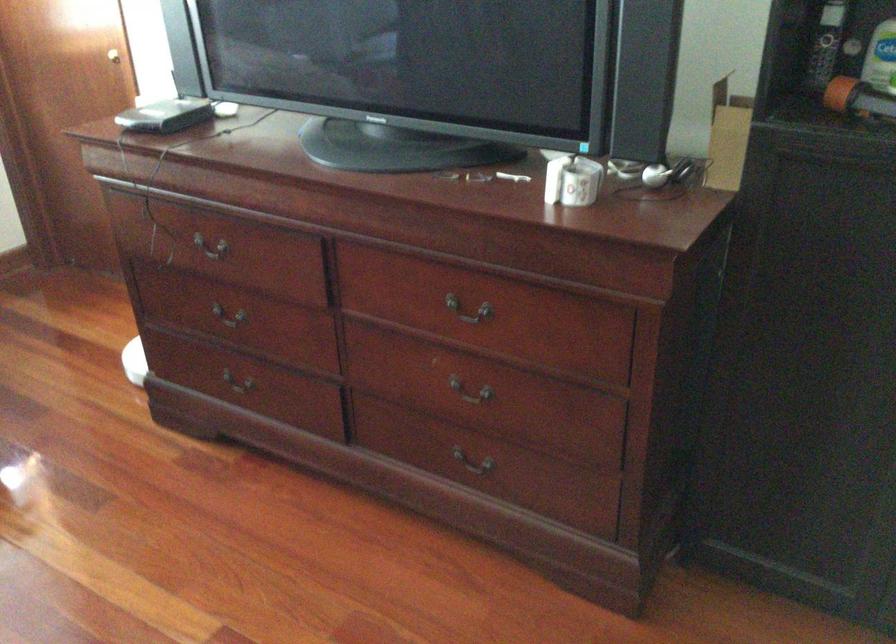
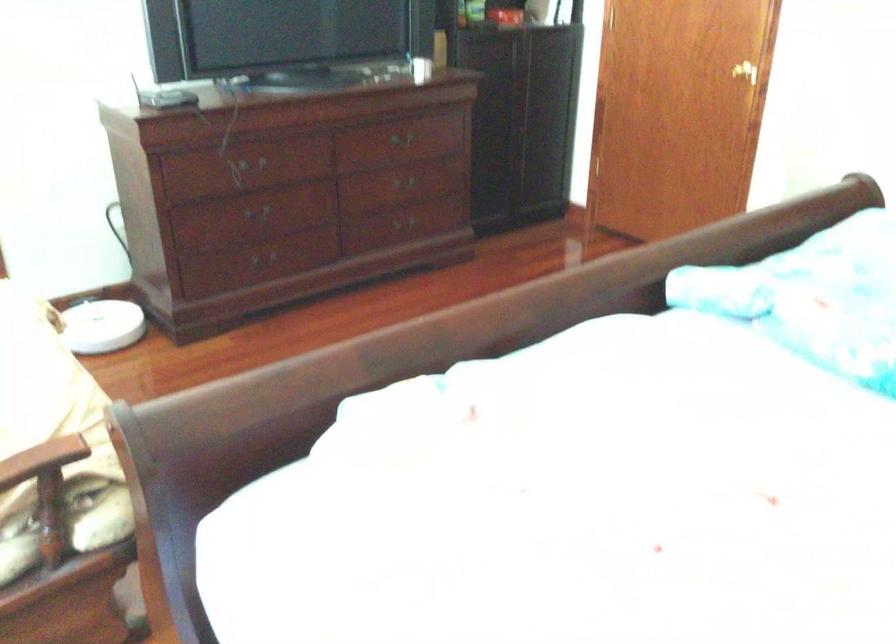
The point at [494,323] is marked in the first image. Where is the corresponding point in the second image?

(401, 138)